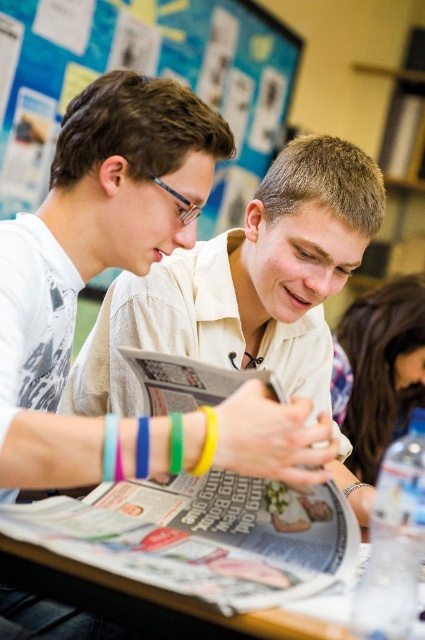
Consider the image. Who is positioned more to the left, blue paperboard at upper center or wooden table at lower center?

From the viewer's perspective, blue paperboard at upper center appears more on the left side.

Between point (200, 12) and point (212, 625), which one is positioned in front?

Point (212, 625) is more forward.

The height and width of the screenshot is (640, 425). I want to click on blue paperboard at upper center, so [146, 74].

Does brown leather wallet at lower right have a greater height compared to wooden table at lower center?

Yes.

Is point (419, 337) behind point (299, 620)?

Yes, point (419, 337) is behind point (299, 620).

Locate an element on the screen. The height and width of the screenshot is (640, 425). brown leather wallet at lower right is located at coordinates (379, 369).

Can you confirm if white matte shirt at center is positioned to the left of wooden table at lower center?

Incorrect, white matte shirt at center is not on the left side of wooden table at lower center.

Which is below, white matte shirt at center or wooden table at lower center?

wooden table at lower center is lower down.

The image size is (425, 640). What do you see at coordinates (244, 284) in the screenshot?
I see `white matte shirt at center` at bounding box center [244, 284].

Locate an element on the screen. white matte shirt at center is located at coordinates pyautogui.click(x=244, y=284).